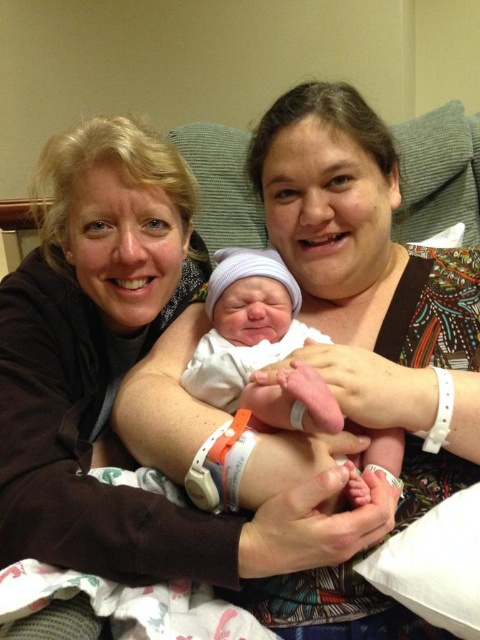
Based on the scene description, where is the matte brown shirt at center located in terms of its 2D coordinates?

The matte brown shirt at center is located at the 2D coordinates of point (372, 288).

You are a photographer standing 5 feet away from the two adults and the newborn. You want to capture a closeup shot of the matte brown shirt at center and the smooth white swaddle at center. Can you fit both objects into your camera frame if your camera has a minimum focus distance of 4 feet?

The minimum focus distance of your camera is 4 feet, and you are standing 5 feet away from the objects. Since 5 feet is greater than 4 feet, the camera can focus on both the matte brown shirt at center and the smooth white swaddle at center. Additionally, the distance between the two objects is 3.98 inches, which is small enough to fit within the camera frame when focused at that distance.